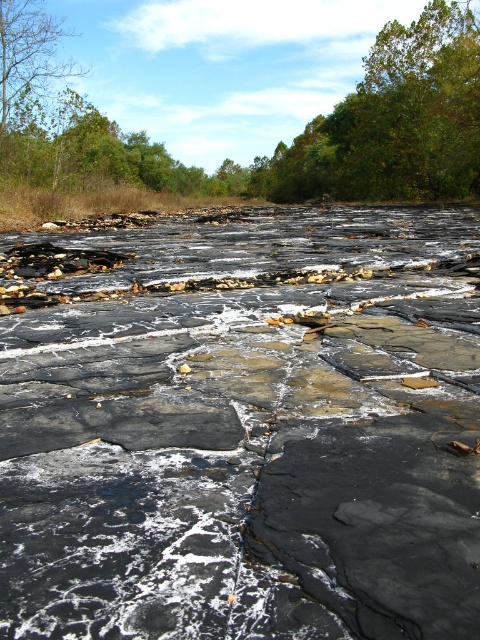
Does green leafy tree at upper center have a greater height compared to green leafy tree at upper right?

No.

Who is more distant from viewer, (51,150) or (342,145)?

The point (342,145) is more distant.

Identify the location of green leafy tree at upper center. (300, 132).

Is black stone creek at center below brown leafy tree at upper left?

Yes.

Does point (373, 467) come closer to viewer compared to point (21, 58)?

Yes.

What do you see at coordinates (242, 426) in the screenshot? I see `black stone creek at center` at bounding box center [242, 426].

The image size is (480, 640). In order to click on black stone creek at center in this screenshot , I will do `click(242, 426)`.

Is black stone creek at center smaller than green leafy tree at upper right?

Correct, black stone creek at center occupies less space than green leafy tree at upper right.

Does black stone creek at center appear on the right side of green leafy tree at upper right?

In fact, black stone creek at center is to the left of green leafy tree at upper right.

Image resolution: width=480 pixels, height=640 pixels. I want to click on black stone creek at center, so click(242, 426).

At what (x,y) coordinates should I click in order to perform the action: click on black stone creek at center. Please return your answer as a coordinate pair (x, y). This screenshot has width=480, height=640. Looking at the image, I should click on (242, 426).